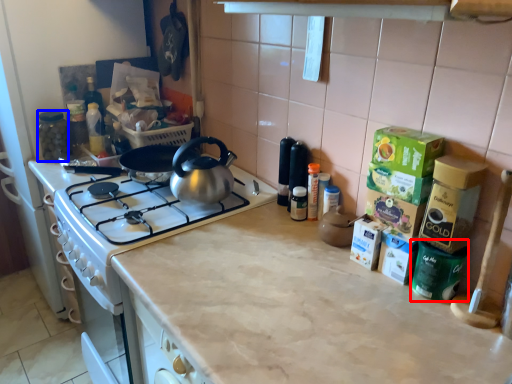
Question: Which object is closer to the camera taking this photo, appliance (highlighted by a red box) or appliance (highlighted by a blue box)?

Choices:
 (A) appliance
 (B) appliance

Answer: (A)